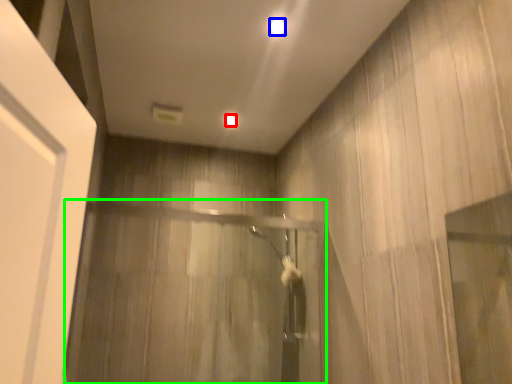
Question: Which object is positioned closest to lighting (highlighted by a red box)? Select from lighting (highlighted by a blue box) and screen door (highlighted by a green box).

Choices:
 (A) lighting
 (B) screen door

Answer: (A)